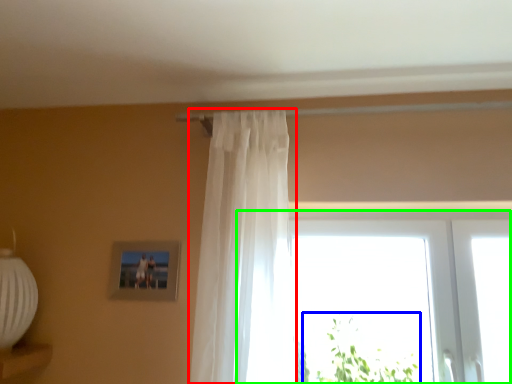
Question: Which object is the closest to the curtain (highlighted by a red box)? Choose among these: plant (highlighted by a blue box) or window (highlighted by a green box).

Choices:
 (A) plant
 (B) window

Answer: (B)